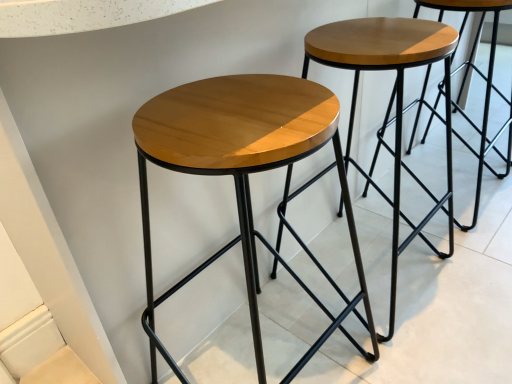
At what (x,y) coordinates should I click in order to perform the action: click on vacant point above shiny wood stool at center, which ranks as the 1th stool in left-to-right order (from a real-world perspective). Please return your answer as a coordinate pair (x, y). This screenshot has height=384, width=512. Looking at the image, I should click on (241, 110).